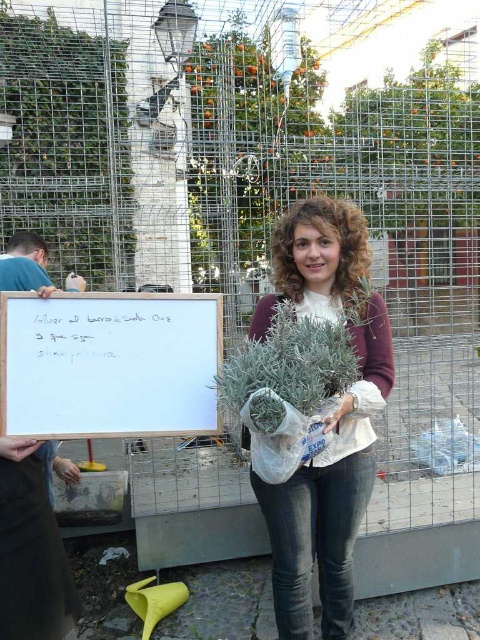
Question: Which is nearer to the white wooden board at center?

Choices:
 (A) green leafy plant at center
 (B) matte white sweater at center

Answer: (A)

Question: Is matte white sweater at center smaller than white wooden board at center?

Choices:
 (A) no
 (B) yes

Answer: (A)

Question: Is matte white sweater at center thinner than white wooden board at center?

Choices:
 (A) yes
 (B) no

Answer: (A)

Question: Which of the following is the farthest from the observer?

Choices:
 (A) green leafy plant at center
 (B) matte white sweater at center

Answer: (B)

Question: Does matte white sweater at center come in front of white wooden board at center?

Choices:
 (A) yes
 (B) no

Answer: (A)

Question: Which of these objects is positioned farthest from the white wooden board at center?

Choices:
 (A) green leafy plant at center
 (B) matte white sweater at center

Answer: (B)